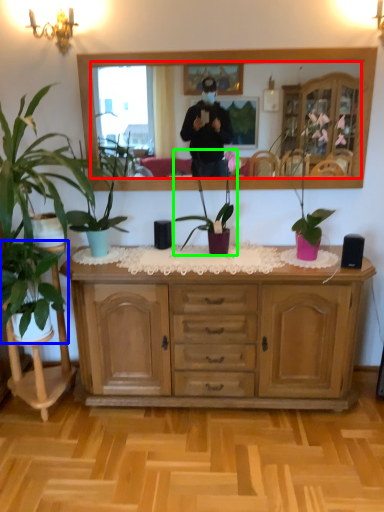
Question: Based on their relative distances, which object is nearer to mirror (highlighted by a red box)? Choose from houseplant (highlighted by a blue box) and houseplant (highlighted by a green box).

Choices:
 (A) houseplant
 (B) houseplant

Answer: (B)